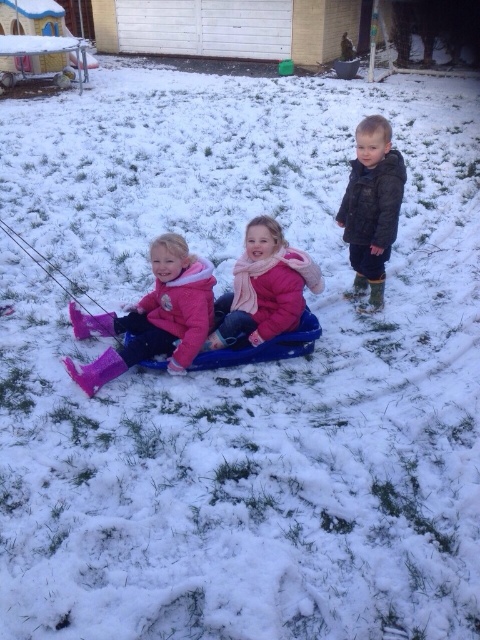
Can you confirm if matte pink snowsuit at left is bigger than pink fleece jacket at center?

Indeed, matte pink snowsuit at left has a larger size compared to pink fleece jacket at center.

Which is more to the right, matte pink snowsuit at left or pink fleece jacket at center?

pink fleece jacket at center

The height and width of the screenshot is (640, 480). Find the location of `matte pink snowsuit at left`. matte pink snowsuit at left is located at coordinates (153, 317).

What do you see at coordinates (153, 317) in the screenshot? Image resolution: width=480 pixels, height=640 pixels. I see `matte pink snowsuit at left` at bounding box center [153, 317].

Between matte pink snowsuit at left and dark green jacket at upper right, which one appears on the right side from the viewer's perspective?

dark green jacket at upper right

Which is behind, point (204, 259) or point (360, 285)?

Point (204, 259)

The height and width of the screenshot is (640, 480). I want to click on matte pink snowsuit at left, so click(153, 317).

Which is more to the right, pink fleece jacket at center or dark green jacket at upper right?

dark green jacket at upper right

Which is behind, point (251, 291) or point (347, 236)?

The point (347, 236) is more distant.

Find the location of a particular element. The width and height of the screenshot is (480, 640). pink fleece jacket at center is located at coordinates point(264,289).